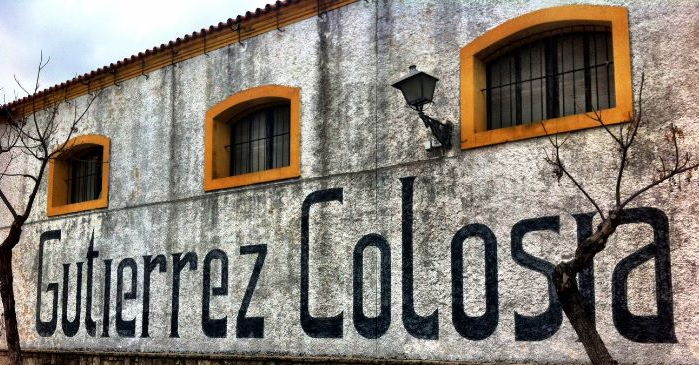
In order to click on window frame in this screenshot , I will do `click(91, 140)`, `click(238, 97)`, `click(526, 21)`.